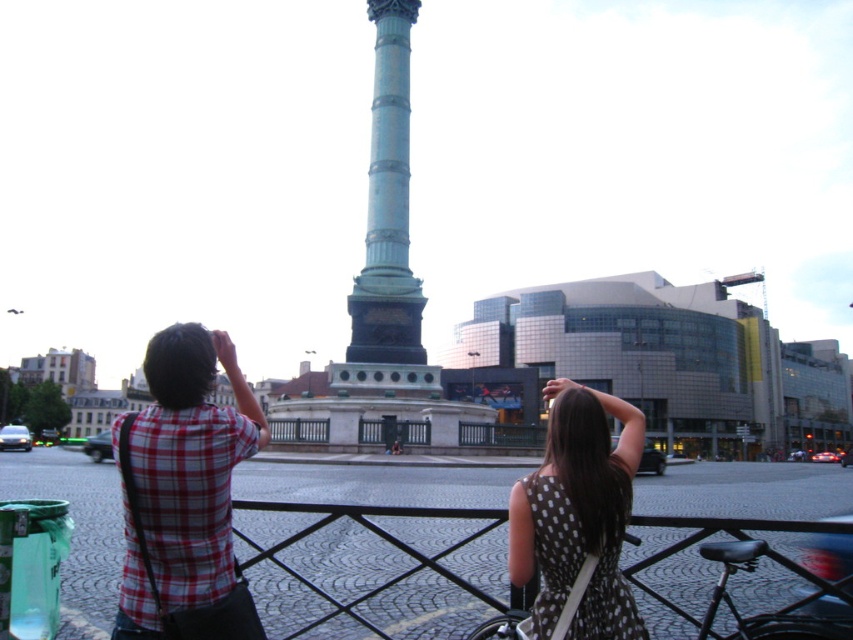
Is red plaid shirt at left below polka dot dress at center?

Incorrect, red plaid shirt at left is not positioned below polka dot dress at center.

Measure the distance between point [230,579] and camera.

Point [230,579] and camera are 34.35 meters apart.

Where is `red plaid shirt at left`? Image resolution: width=853 pixels, height=640 pixels. red plaid shirt at left is located at coordinates (183, 484).

Which is above, polka dot dress at center or green polished column at center?

Positioned higher is green polished column at center.

How far apart are polka dot dress at center and green polished column at center?

polka dot dress at center is 40.78 meters from green polished column at center.

Between point (601, 632) and point (389, 321), which one is positioned behind?

The point (389, 321) is more distant.

Find the location of a particular element. Image resolution: width=853 pixels, height=640 pixels. polka dot dress at center is located at coordinates (578, 513).

Can you confirm if red plaid shirt at left is smaller than green polished column at center?

Yes.

Where is `red plaid shirt at left`? Image resolution: width=853 pixels, height=640 pixels. red plaid shirt at left is located at coordinates (183, 484).